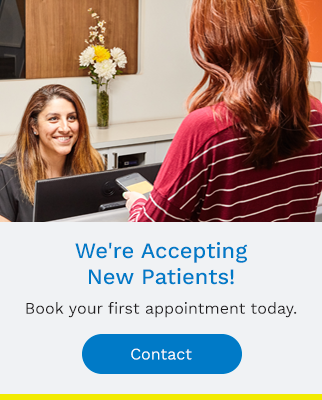
What are the coordinates of `vase` in the screenshot? It's located at (104, 104).